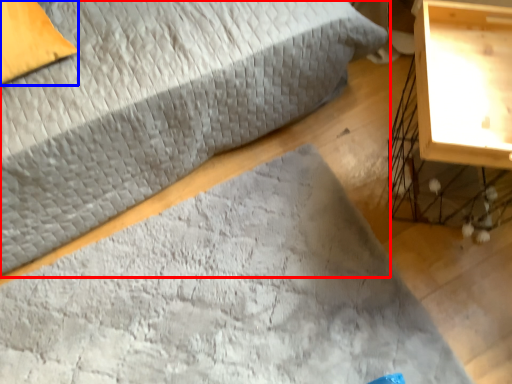
Question: Which object is closer to the camera taking this photo, bed (highlighted by a red box) or pillow (highlighted by a blue box)?

Choices:
 (A) bed
 (B) pillow

Answer: (A)